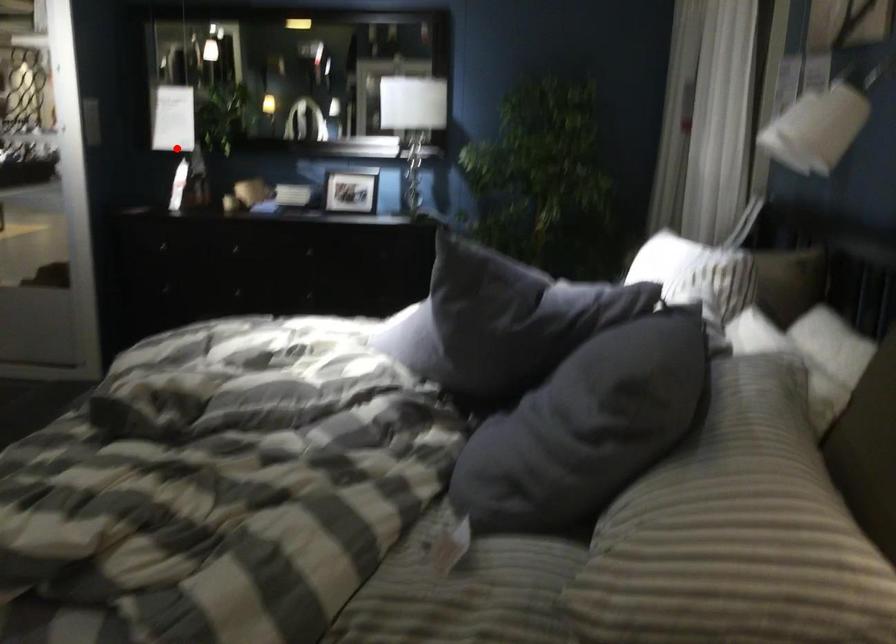
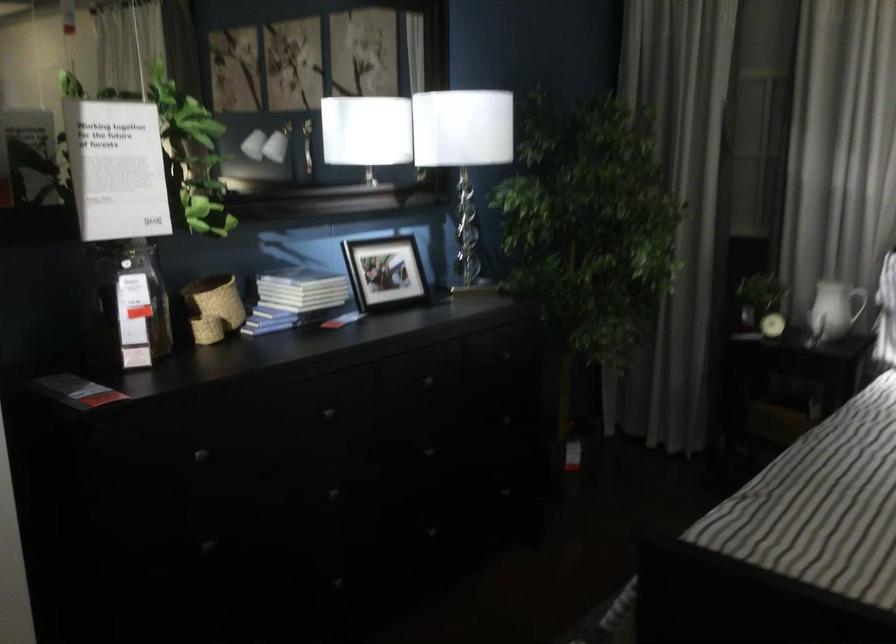
The point at the highlighted location is marked in the first image. Where is the corresponding point in the second image?

(126, 305)